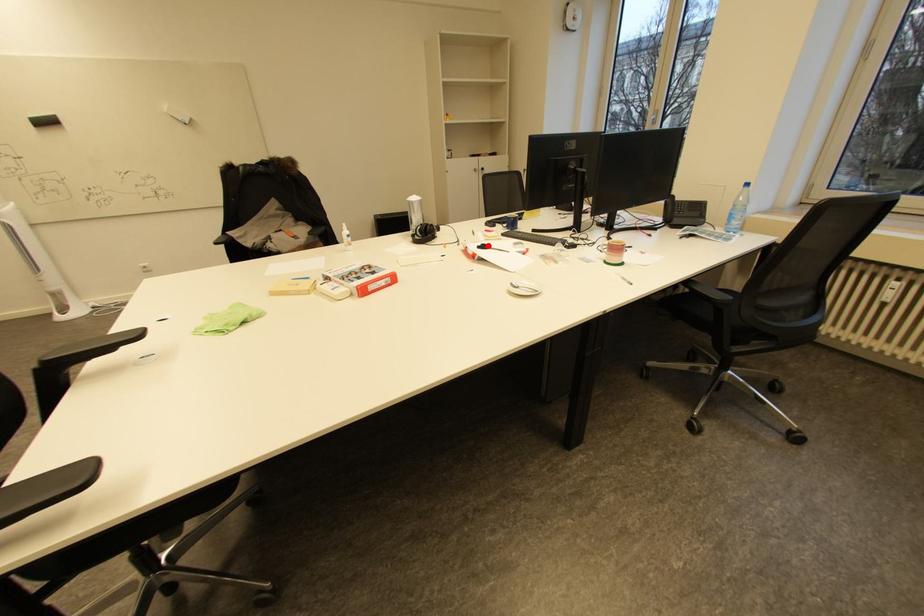
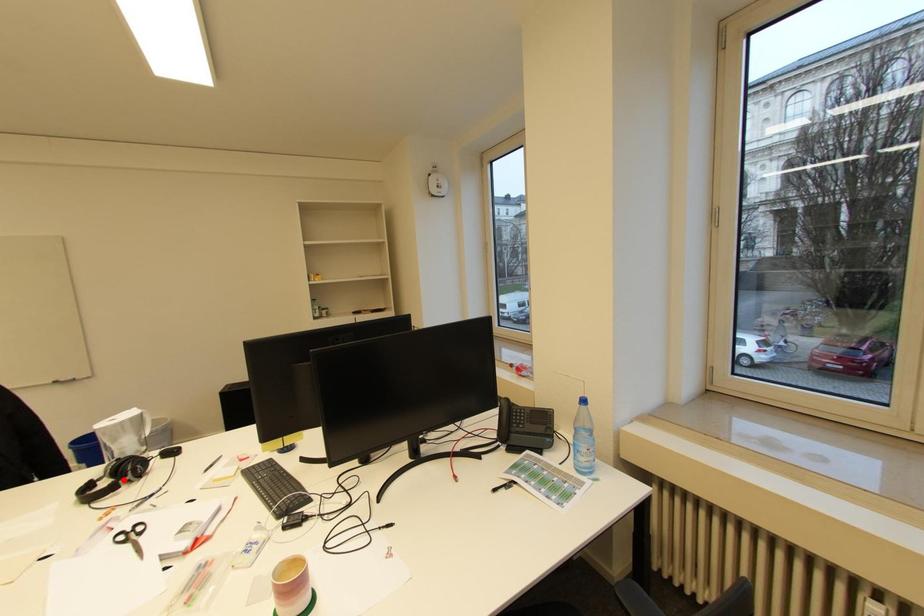
Based on the photo, I am providing you with two images of the same scene from different viewpoints. A red point is marked on the first image and another point is marked on the second image. Is the red point in image1 aligned with the point shown in image2?

No